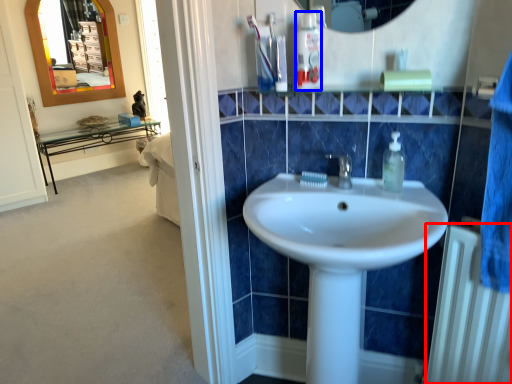
Question: Which point is further to the camera, radiator (highlighted by a red box) or mouthwash (highlighted by a blue box)?

Choices:
 (A) radiator
 (B) mouthwash

Answer: (B)